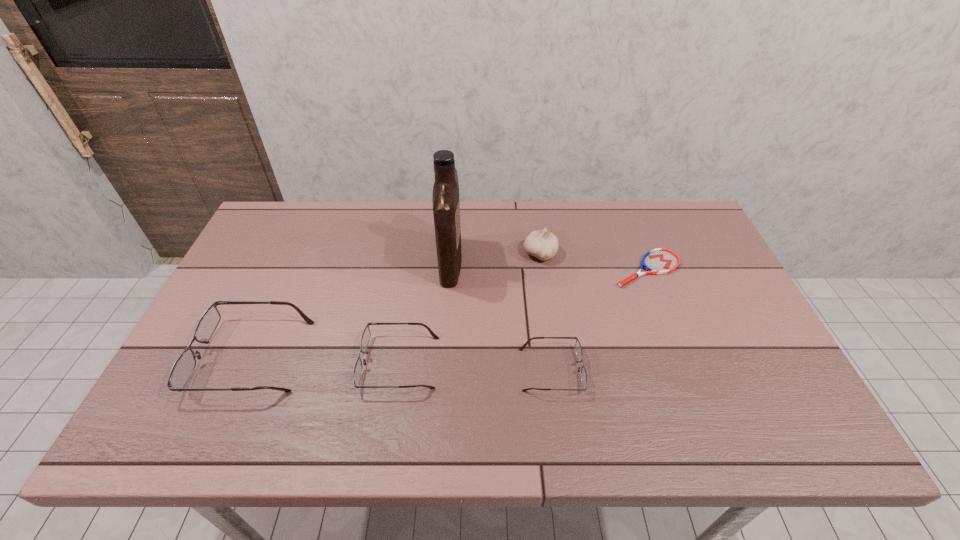
The height and width of the screenshot is (540, 960). I want to click on free space located on the front-facing side of the second tallest spectacles, so click(x=215, y=363).

Where is `vacant point located 0.270m on the front-facing side of the second tallest spectacles`? This screenshot has width=960, height=540. vacant point located 0.270m on the front-facing side of the second tallest spectacles is located at coordinates (252, 363).

You are a GUI agent. You are given a task and a screenshot of the screen. Output one action in this format:
    pyautogui.click(x=<x>, y=<y>)
    Task: Click on the vacant area situated 0.160m on the front-facing side of the second tallest spectacles
    The width and height of the screenshot is (960, 540).
    Given the screenshot: What is the action you would take?
    pyautogui.click(x=297, y=363)

Where is `vacant space situated 0.240m on the front-facing side of the second shortest object`? This screenshot has width=960, height=540. vacant space situated 0.240m on the front-facing side of the second shortest object is located at coordinates 681,370.

Locate an element on the screen. The width and height of the screenshot is (960, 540). free location located 0.300m on the left of the shortest object is located at coordinates (512, 269).

In order to click on vacant position located on the label side of the liquor in this screenshot , I will do `click(567, 262)`.

The width and height of the screenshot is (960, 540). What are the coordinates of `vacant space located 0.240m on the left of the garlic` in the screenshot? It's located at (445, 254).

Identify the location of liquor present at the far edge. The width and height of the screenshot is (960, 540). (446, 203).

Identify the location of garlic that is at the far edge. (542, 244).

Image resolution: width=960 pixels, height=540 pixels. I want to click on object located at the left edge, so click(184, 366).